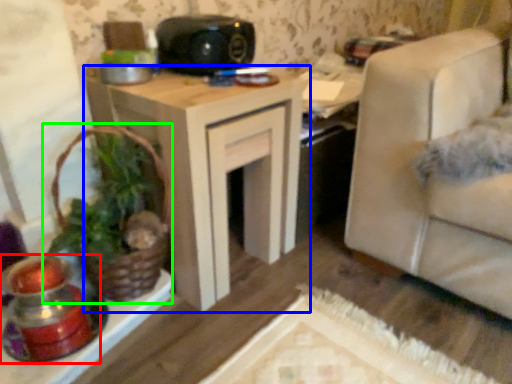
Question: Considering the real-world distances, which object is closest to candle holder (highlighted by a red box)? table (highlighted by a blue box) or houseplant (highlighted by a green box).

Choices:
 (A) table
 (B) houseplant

Answer: (B)